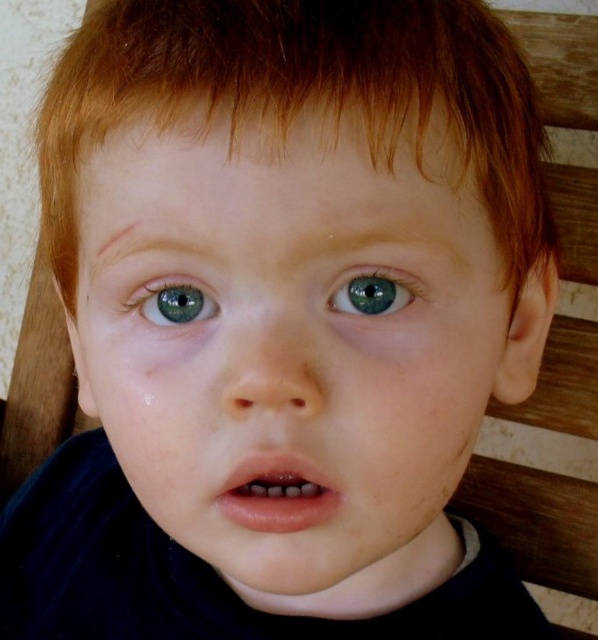
Is smooth skin face at center closer to camera compared to blue glossy eye at center?

Yes.

Is smooth skin face at center to the right of blue glossy eye at center from the viewer's perspective?

In fact, smooth skin face at center is to the left of blue glossy eye at center.

Between point (460, 378) and point (405, 304), which one is positioned in front?

Positioned in front is point (405, 304).

Where is `smooth skin face at center`? This screenshot has width=598, height=640. smooth skin face at center is located at coordinates (291, 346).

Between blue glossy eye at upper left and blue glossy eye at center, which one has more height?

blue glossy eye at upper left

Can you confirm if blue glossy eye at upper left is positioned above blue glossy eye at center?

Yes.

Is point (191, 291) closer to camera compared to point (355, 292)?

No.

The height and width of the screenshot is (640, 598). I want to click on blue glossy eye at upper left, so click(x=175, y=301).

Between smooth skin face at center and reddish brown hair at upper center, which one is positioned lower?

smooth skin face at center is lower down.

Does smooth skin face at center come in front of reddish brown hair at upper center?

That is False.

At what (x,y) coordinates should I click in order to perform the action: click on smooth skin face at center. Please return your answer as a coordinate pair (x, y). This screenshot has height=640, width=598. Looking at the image, I should click on (291, 346).